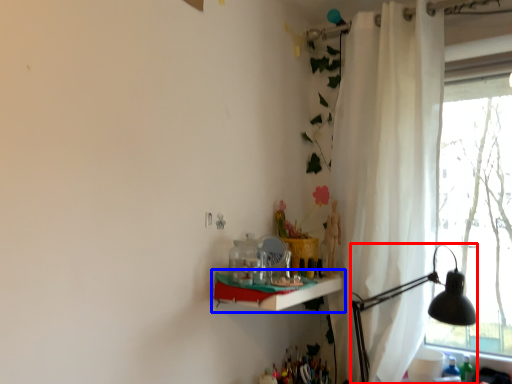
Question: Which of the following is the closest to the observer, table lamp (highlighted by a red box) or shelf (highlighted by a blue box)?

Choices:
 (A) table lamp
 (B) shelf

Answer: (B)